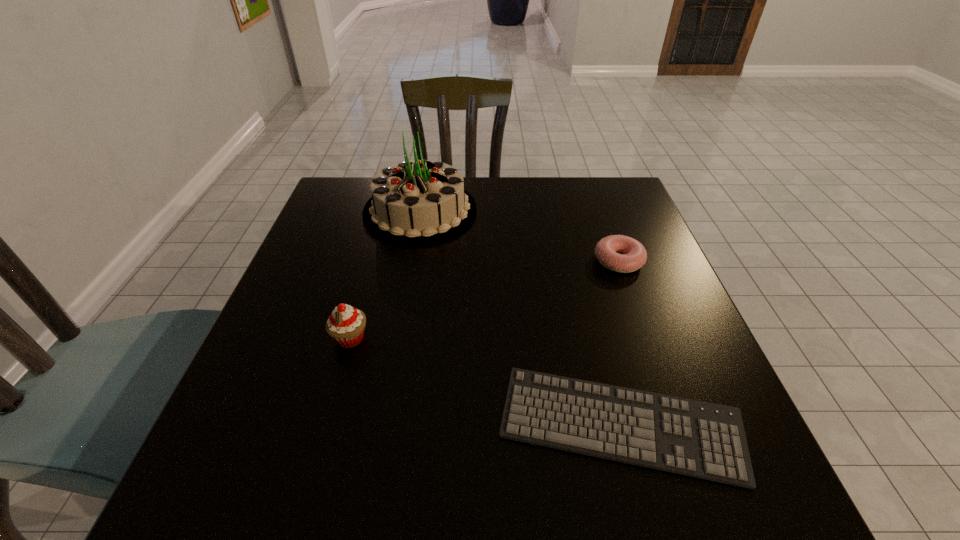
Locate an element on the screen. The image size is (960, 540). birthday cake is located at coordinates (420, 202).

Locate an element on the screen. cupcake is located at coordinates (346, 324).

Image resolution: width=960 pixels, height=540 pixels. I want to click on the third farthest object, so click(x=346, y=324).

The height and width of the screenshot is (540, 960). I want to click on the second shortest object, so click(x=634, y=255).

Where is `computer keyboard`? computer keyboard is located at coordinates coord(705,440).

Where is `the shortest object`? The height and width of the screenshot is (540, 960). the shortest object is located at coordinates (705, 440).

Locate an element on the screen. free location located 0.140m on the right of the tallest object is located at coordinates (528, 211).

Identify the location of vacant space located on the back of the third farthest object. (372, 261).

The width and height of the screenshot is (960, 540). I want to click on vacant position located 0.270m on the front of the doughnut, so click(661, 377).

Image resolution: width=960 pixels, height=540 pixels. Identify the location of blank area located 0.400m on the back of the shortest object. (573, 240).